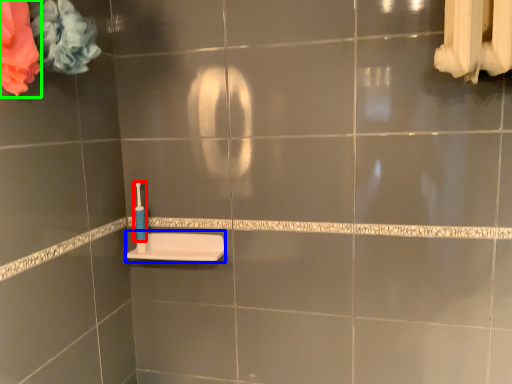
Question: Which object is the farthest from toothbrush (highlighted by a red box)? Choose among these: sink (highlighted by a blue box) or flower (highlighted by a green box).

Choices:
 (A) sink
 (B) flower

Answer: (B)